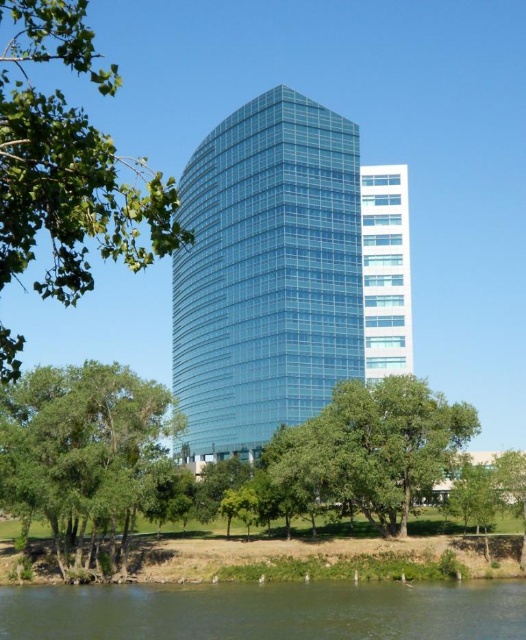
You are standing at the edge of the water and see both the green leafy tree at lower left and the white glass building at center. Which object is closer to you?

The green leafy tree at lower left is closer to you because it is in front of the white glass building at center.

You are standing on a path near the green water at lower left and the green leafy tree at lower left. Which object is closer to you?

The green water at lower left is closer to you because it is in front of the green leafy tree at lower left.

You are standing at the point marked as point (68, 163). What can you see immediately around you?

At point (68, 163), you can see a green leafy tree at left immediately around you.